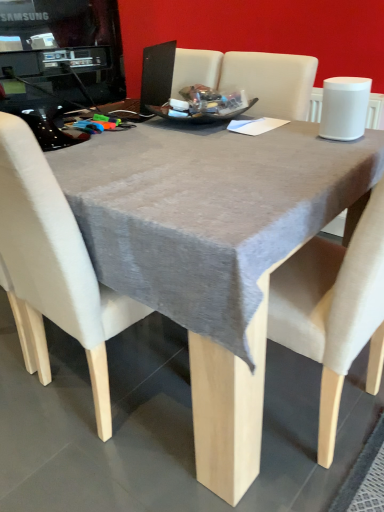
Question: From a real-world perspective, is black glossy desktop computer at upper left beneath gray fabric table at center?

Choices:
 (A) no
 (B) yes

Answer: (A)

Question: From the image's perspective, is black glossy desktop computer at upper left above gray fabric table at center?

Choices:
 (A) yes
 (B) no

Answer: (A)

Question: Considering the relative sizes of black glossy desktop computer at upper left and gray fabric table at center in the image provided, is black glossy desktop computer at upper left taller than gray fabric table at center?

Choices:
 (A) yes
 (B) no

Answer: (B)

Question: From a real-world perspective, is black glossy desktop computer at upper left positioned over gray fabric table at center based on gravity?

Choices:
 (A) yes
 (B) no

Answer: (A)

Question: Is black glossy desktop computer at upper left facing towards gray fabric table at center?

Choices:
 (A) yes
 (B) no

Answer: (B)

Question: From a real-world perspective, is black glossy desktop computer at upper left above or below gray fabric table at center?

Choices:
 (A) above
 (B) below

Answer: (A)

Question: From the image's perspective, is black glossy desktop computer at upper left above or below gray fabric table at center?

Choices:
 (A) above
 (B) below

Answer: (A)

Question: Based on their sizes in the image, would you say black glossy desktop computer at upper left is bigger or smaller than gray fabric table at center?

Choices:
 (A) big
 (B) small

Answer: (B)

Question: Is black glossy desktop computer at upper left inside the boundaries of gray fabric table at center, or outside?

Choices:
 (A) inside
 (B) outside

Answer: (B)

Question: From the image's perspective, relative to beige fabric chair at center, is gray fabric table at center above or below?

Choices:
 (A) below
 (B) above

Answer: (B)

Question: In terms of width, does gray fabric table at center look wider or thinner when compared to beige fabric chair at center?

Choices:
 (A) thin
 (B) wide

Answer: (B)

Question: Choose the correct answer: Is gray fabric table at center inside beige fabric chair at center or outside it?

Choices:
 (A) outside
 (B) inside

Answer: (A)

Question: In terms of size, does gray fabric table at center appear bigger or smaller than beige fabric chair at center?

Choices:
 (A) small
 (B) big

Answer: (B)

Question: Looking at their shapes, would you say beige fabric chair at center is wider or thinner than gray fabric table at center?

Choices:
 (A) thin
 (B) wide

Answer: (A)

Question: In terms of height, does beige fabric chair at center look taller or shorter compared to gray fabric table at center?

Choices:
 (A) tall
 (B) short

Answer: (A)